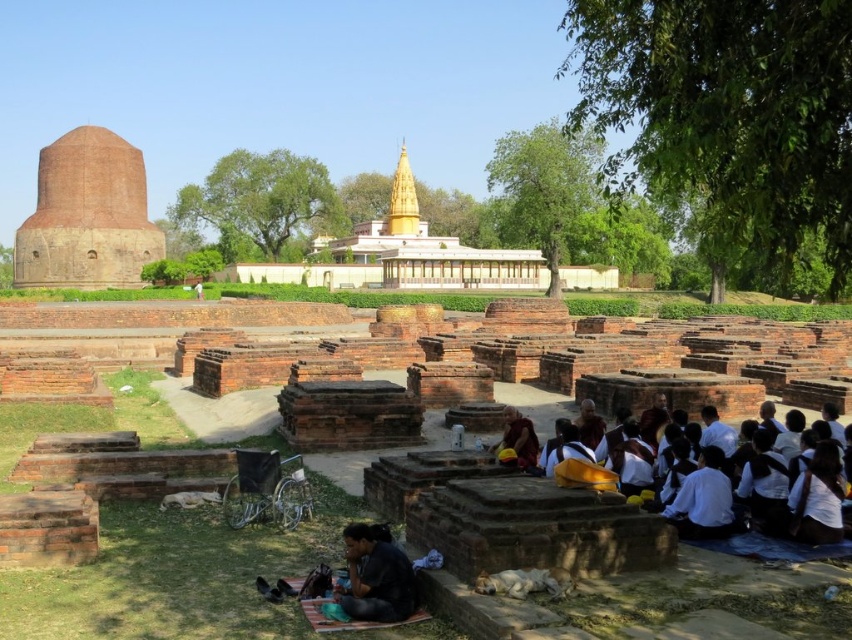
Between black fabric at lower center and golden robe at center, which one has more height?

Standing taller between the two is black fabric at lower center.

Identify the location of black fabric at lower center. (375, 577).

Is brick stupa at left shorter than golden robe at center?

No, brick stupa at left is not shorter than golden robe at center.

Which is behind, point (24, 236) or point (521, 452)?

The point (24, 236) is more distant.

Is point (20, 236) positioned before point (516, 442)?

No, it is behind (516, 442).

Image resolution: width=852 pixels, height=640 pixels. What are the coordinates of `brick stupa at left` in the screenshot? It's located at (87, 216).

Who is more forward, (133, 204) or (390, 609)?

Point (390, 609)

Who is more distant from viewer, (50, 145) or (396, 568)?

Positioned behind is point (50, 145).

Image resolution: width=852 pixels, height=640 pixels. In order to click on brick stupa at left in this screenshot , I will do `click(87, 216)`.